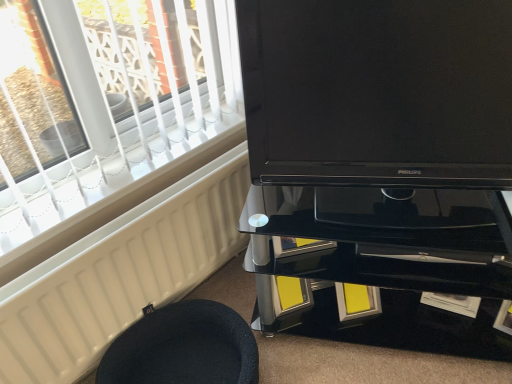
Find the location of a particular element. Image resolution: width=512 pixels, height=384 pixels. black glass tv cabinet at center is located at coordinates [381, 266].

I want to click on black fabric stool at lower left, so click(x=183, y=347).

The height and width of the screenshot is (384, 512). Describe the element at coordinates (378, 92) in the screenshot. I see `matte black tv at center` at that location.

At what (x,y) coordinates should I click in order to perform the action: click on white matte radiator at lower left. Please return your answer as a coordinate pair (x, y). This screenshot has height=384, width=512. Looking at the image, I should click on (121, 274).

Could you tell me if white matte radiator at lower left is turned towards matte black tv at center?

No, white matte radiator at lower left is not aimed at matte black tv at center.

Based on the photo, between white matte radiator at lower left and matte black tv at center, which one has smaller width?

With smaller width is white matte radiator at lower left.

How different are the orientations of white matte radiator at lower left and matte black tv at center in degrees?

The angle between the facing direction of white matte radiator at lower left and the facing direction of matte black tv at center is 53.9 degrees.

Is point (103, 237) closer to viewer compared to point (415, 129)?

No, (103, 237) is behind (415, 129).

Is black glass tv cabinet at center further to camera compared to white matte radiator at lower left?

Yes, black glass tv cabinet at center is further from the camera.

Is black glass tv cabinet at center wider or thinner than white matte radiator at lower left?

Clearly, black glass tv cabinet at center has more width compared to white matte radiator at lower left.

Can you tell me how much black glass tv cabinet at center and white matte radiator at lower left differ in facing direction?

They differ by 57.5 degrees in their facing directions.

Considering the relative positions of matte black tv at center and black glass tv cabinet at center in the image provided, is matte black tv at center to the right of black glass tv cabinet at center from the viewer's perspective?

No, matte black tv at center is not to the right of black glass tv cabinet at center.

Does matte black tv at center lie in front of black glass tv cabinet at center?

Yes, matte black tv at center is closer to the camera.

Can you confirm if matte black tv at center is thinner than black glass tv cabinet at center?

Yes, matte black tv at center is thinner than black glass tv cabinet at center.

Can you confirm if white matte radiator at lower left is smaller than black fabric stool at lower left?

Correct, white matte radiator at lower left occupies less space than black fabric stool at lower left.

Based on the photo, can you confirm if white matte radiator at lower left is positioned to the right of black fabric stool at lower left?

No, white matte radiator at lower left is not to the right of black fabric stool at lower left.

Is white matte radiator at lower left thinner than black fabric stool at lower left?

Indeed, white matte radiator at lower left has a lesser width compared to black fabric stool at lower left.

I want to click on furniture below the white matte radiator at lower left (from the image's perspective), so click(183, 347).

Based on the photo, does matte black tv at center turn towards white matte radiator at lower left?

No.

Considering the sizes of matte black tv at center and white matte radiator at lower left in the image, is matte black tv at center taller or shorter than white matte radiator at lower left?

Considering their sizes, matte black tv at center has more height than white matte radiator at lower left.

From the image's perspective, is matte black tv at center on top of white matte radiator at lower left?

Correct, matte black tv at center appears higher than white matte radiator at lower left in the image.

Is matte black tv at center wider or thinner than white matte radiator at lower left?

In the image, matte black tv at center appears to be wider than white matte radiator at lower left.

Which is nearer, [123,332] or [40,370]?

Point [123,332].

In the image, is black fabric stool at lower left on the left side or the right side of white matte radiator at lower left?

black fabric stool at lower left is to the right of white matte radiator at lower left.

How much distance is there between black fabric stool at lower left and white matte radiator at lower left?

They are 19.46 centimeters apart.

From a real-world perspective, is black glass tv cabinet at center above or below black fabric stool at lower left?

black glass tv cabinet at center is situated higher than black fabric stool at lower left in the real world.

At what (x,y) coordinates should I click in order to perform the action: click on tv cabinet behind the black fabric stool at lower left. Please return your answer as a coordinate pair (x, y). The image size is (512, 384). Looking at the image, I should click on [x=381, y=266].

Considering the sizes of black glass tv cabinet at center and black fabric stool at lower left in the image, is black glass tv cabinet at center wider or thinner than black fabric stool at lower left?

In the image, black glass tv cabinet at center appears to be more narrow than black fabric stool at lower left.

Can you confirm if black glass tv cabinet at center is positioned to the left of black fabric stool at lower left?

No, black glass tv cabinet at center is not to the left of black fabric stool at lower left.

At what (x,y) coordinates should I click in order to perform the action: click on radiator behind the matte black tv at center. Please return your answer as a coordinate pair (x, y). Looking at the image, I should click on (121, 274).

This screenshot has width=512, height=384. I want to click on tv cabinet above the white matte radiator at lower left (from the image's perspective), so click(381, 266).

Considering their positions, is black glass tv cabinet at center positioned further to black fabric stool at lower left than matte black tv at center?

Based on the image, matte black tv at center appears to be further to black fabric stool at lower left.

Looking at the image, which one is located further to white matte radiator at lower left, matte black tv at center or black glass tv cabinet at center?

matte black tv at center lies further to white matte radiator at lower left than the other object.

Considering their positions, is white matte radiator at lower left positioned further to matte black tv at center than black fabric stool at lower left?

black fabric stool at lower left lies further to matte black tv at center than the other object.

From the image, which object appears to be nearer to black fabric stool at lower left, matte black tv at center or black glass tv cabinet at center?

black glass tv cabinet at center is closer to black fabric stool at lower left.

Based on their spatial positions, is black glass tv cabinet at center or matte black tv at center further from white matte radiator at lower left?

The object further to white matte radiator at lower left is matte black tv at center.

Considering their positions, is black fabric stool at lower left positioned further to matte black tv at center than black glass tv cabinet at center?

The object further to matte black tv at center is black fabric stool at lower left.

Based on their spatial positions, is black glass tv cabinet at center or black fabric stool at lower left further from matte black tv at center?

black fabric stool at lower left is further to matte black tv at center.

Estimate the real-world distances between objects in this image. Which object is closer to black glass tv cabinet at center, black fabric stool at lower left or matte black tv at center?

matte black tv at center.

The height and width of the screenshot is (384, 512). Find the location of `radiator between matte black tv at center and black fabric stool at lower left in the vertical direction`. radiator between matte black tv at center and black fabric stool at lower left in the vertical direction is located at coordinates (121, 274).

At what (x,y) coordinates should I click in order to perform the action: click on furniture situated between white matte radiator at lower left and black glass tv cabinet at center from left to right. Please return your answer as a coordinate pair (x, y). Looking at the image, I should click on (183, 347).

The image size is (512, 384). Identify the location of computer monitor between white matte radiator at lower left and black glass tv cabinet at center from left to right. (378, 92).

Identify the location of computer monitor situated between black fabric stool at lower left and black glass tv cabinet at center from left to right. (378, 92).